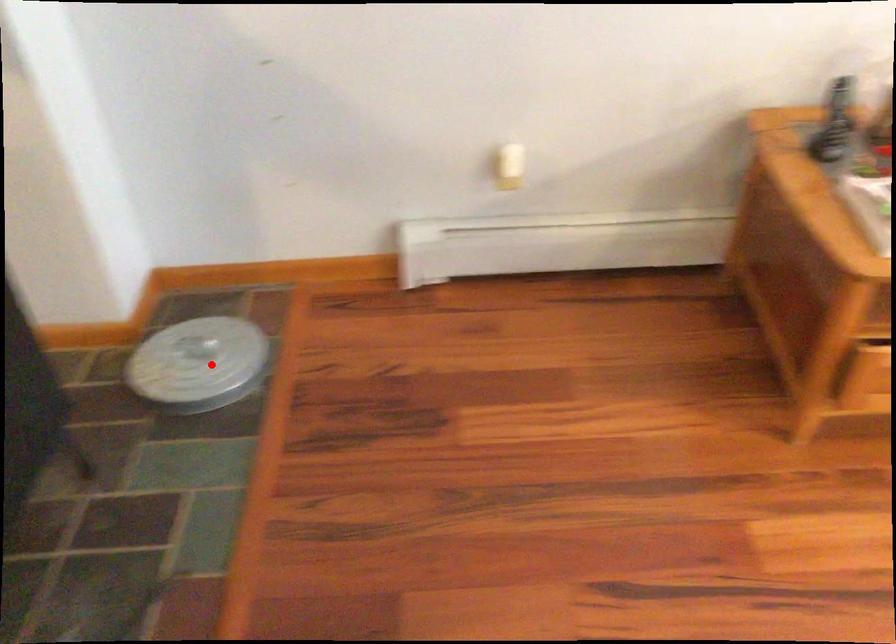
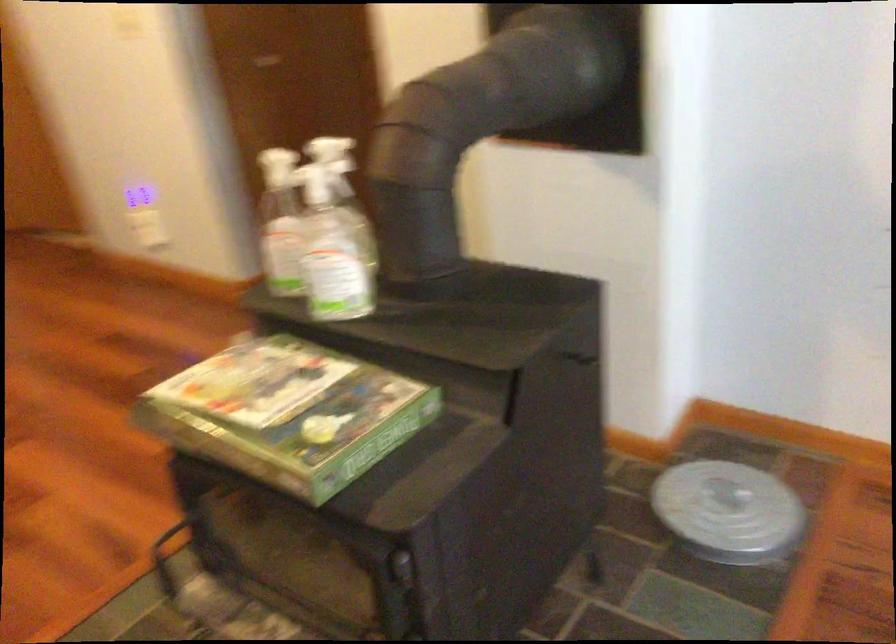
The point at the highlighted location is marked in the first image. Where is the corresponding point in the second image?

(728, 512)